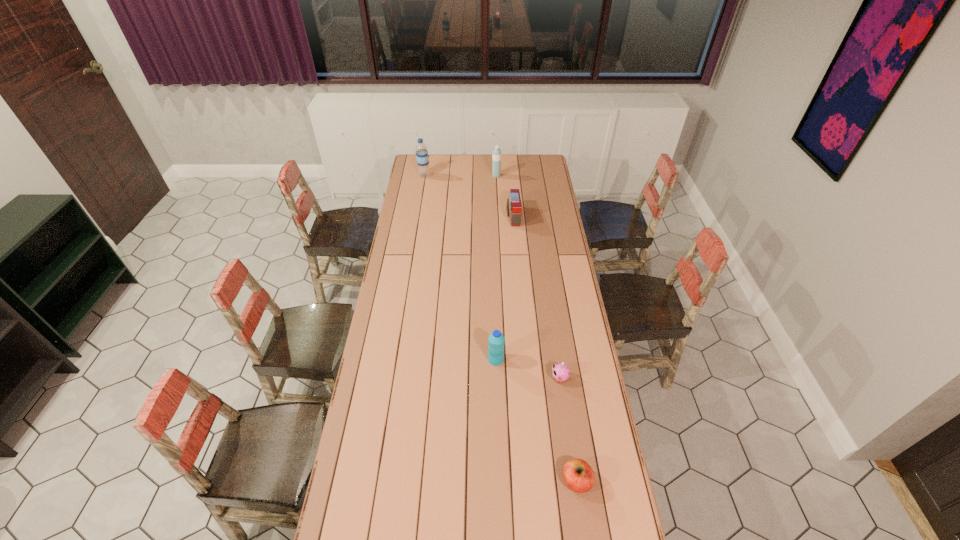
This screenshot has width=960, height=540. In order to click on vacant space located 0.230m on the front-facing side of the third shortest object in this screenshot , I will do `click(464, 217)`.

The width and height of the screenshot is (960, 540). In order to click on blank area located 0.130m on the front-facing side of the third shortest object in this screenshot , I will do `click(482, 217)`.

Where is `free space located 0.220m on the front-facing side of the third shortest object`? The width and height of the screenshot is (960, 540). free space located 0.220m on the front-facing side of the third shortest object is located at coordinates (466, 217).

At what (x,y) coordinates should I click in order to perform the action: click on vacant space located 0.160m on the face of the cupcake. Please return your answer as a coordinate pair (x, y). Looking at the image, I should click on (509, 379).

You are a GUI agent. You are given a task and a screenshot of the screen. Output one action in this format:
    pyautogui.click(x=<x>, y=<y>)
    Task: Click on the vacant space located 0.360m on the face of the cupcake
    This screenshot has width=960, height=540.
    Given the screenshot: What is the action you would take?
    pyautogui.click(x=457, y=379)

The image size is (960, 540). I want to click on vacant area situated on the face of the cupcake, so click(x=512, y=379).

Locate an element on the screen. This screenshot has width=960, height=540. vacant space located on the front of the nearest object is located at coordinates (582, 515).

Find the location of a particular element. object that is positioned at the left edge is located at coordinates (422, 158).

I want to click on cupcake at the right edge, so click(x=560, y=371).

In order to click on apple situated at the right edge in this screenshot , I will do `click(578, 475)`.